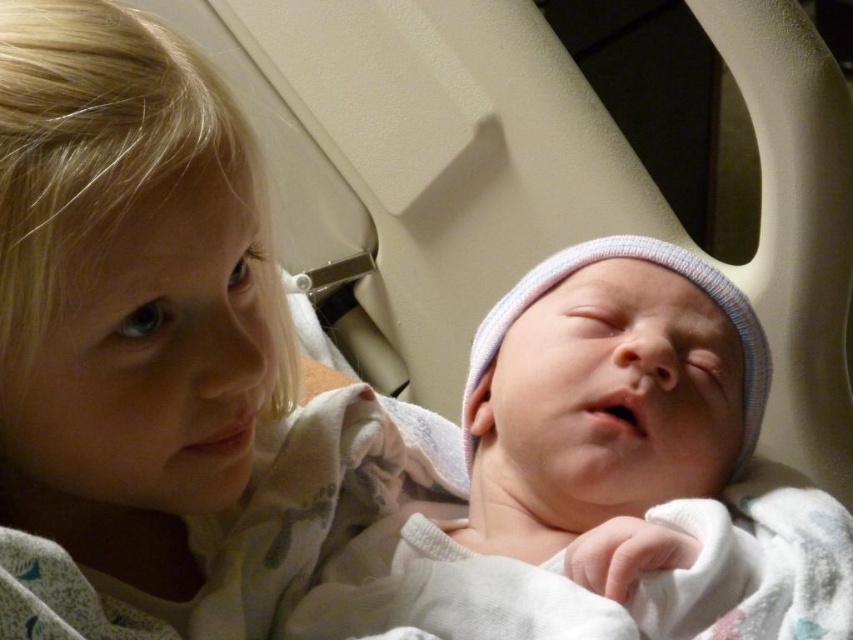
Question: Does smooth white blanket at upper left appear over white soft hat at center?

Choices:
 (A) no
 (B) yes

Answer: (B)

Question: Which point is closer to the camera?

Choices:
 (A) (216, 579)
 (B) (403, 428)

Answer: (A)

Question: Is smooth white blanket at upper left positioned in front of white soft hat at center?

Choices:
 (A) yes
 (B) no

Answer: (A)

Question: Does smooth white blanket at upper left have a smaller size compared to white soft hat at center?

Choices:
 (A) no
 (B) yes

Answer: (A)

Question: Among these objects, which one is nearest to the camera?

Choices:
 (A) white soft hat at center
 (B) smooth white blanket at upper left

Answer: (B)

Question: Which point appears closest to the camera in this image?

Choices:
 (A) coord(22,305)
 (B) coord(538,636)

Answer: (A)